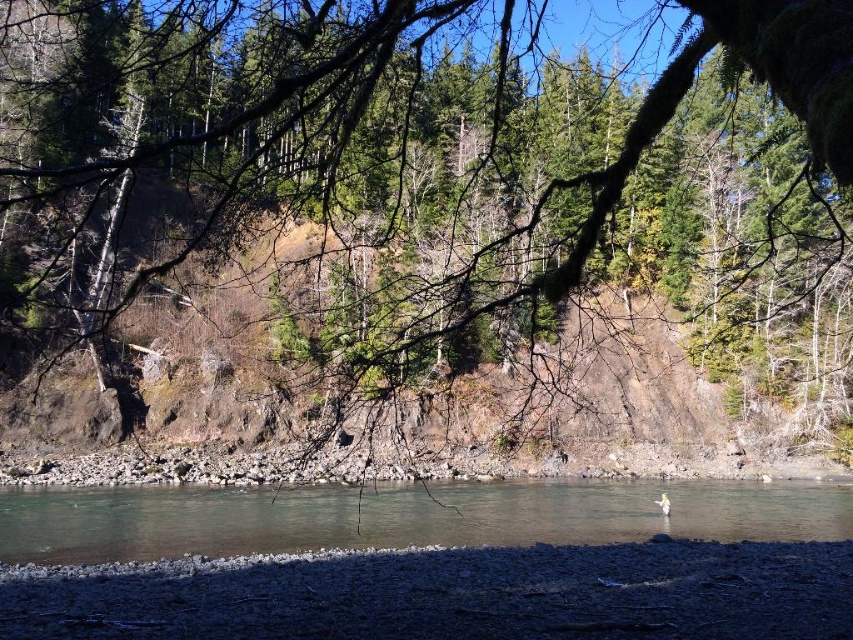
You are standing on the riverbank and want to cast a fishing line into the clear water at center. To avoid hitting the green matte tree at center, in which direction should you aim your cast?

The green matte tree at center is above the clear water at center, so you should aim your cast to the sides of the clear water at center to avoid hitting the tree.

You are a hiker who wants to cross from the green matte tree at center to the clear water at center. Can you walk directly between them without needing to detour? Explain your reasoning based on the distance provided.

The distance between the green matte tree at center and the clear water at center is 14.01 meters. Since there is no mention of obstacles in the scene description, you can walk directly between them without needing to detour.

You are standing on the rocky riverbank and want to take a photo of the green matte tree at center and the clear water at center. Which object will appear larger in the photo?

The green matte tree at center will appear larger in the photo because it is closer to the camera than the clear water at center.